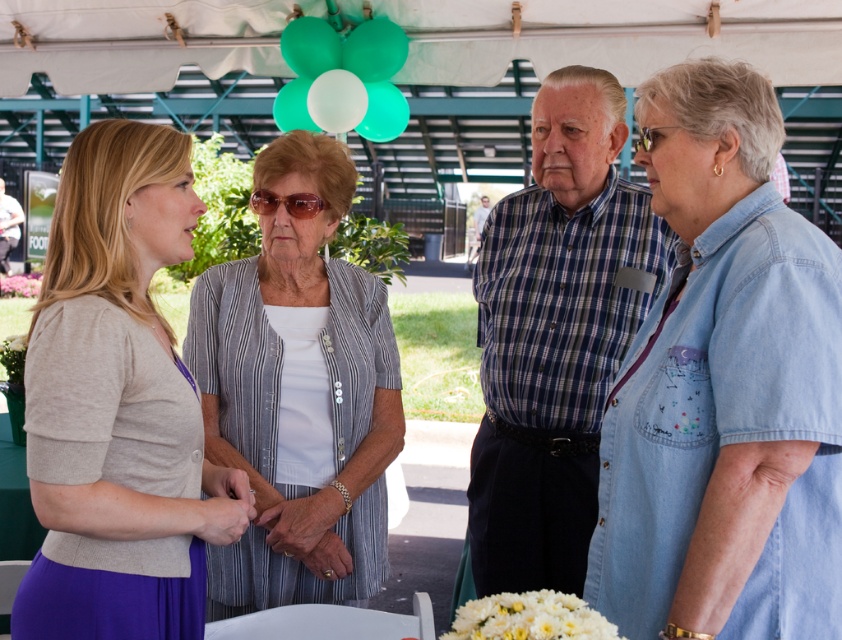
Question: Does plaid shirt at center have a smaller size compared to matte blue shirt at center?

Choices:
 (A) no
 (B) yes

Answer: (A)

Question: Does matte beige cardigan at left have a lesser width compared to striped fabric blouse at center?

Choices:
 (A) yes
 (B) no

Answer: (A)

Question: Estimate the real-world distances between objects in this image. Which object is farther from the striped fabric blouse at center?

Choices:
 (A) matte beige cardigan at left
 (B) denim shirt at right
 (C) plaid shirt at center
 (D) matte blue shirt at center

Answer: (D)

Question: Which is nearer to the plaid shirt at center?

Choices:
 (A) striped fabric blouse at center
 (B) matte beige cardigan at left
 (C) denim shirt at right

Answer: (A)

Question: Can you confirm if denim shirt at right is positioned below plaid shirt at center?

Choices:
 (A) yes
 (B) no

Answer: (B)

Question: Which point appears farthest from the camera in this image?

Choices:
 (A) (35, 424)
 (B) (315, 445)
 (C) (594, 429)

Answer: (C)